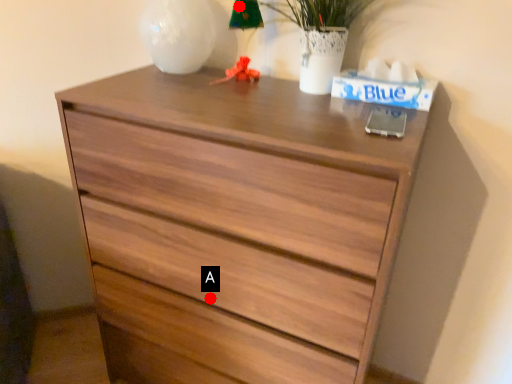
Question: Two points are circled on the image, labeled by A and B beside each circle. Which point is closer to the camera?

Choices:
 (A) A is closer
 (B) B is closer

Answer: (A)